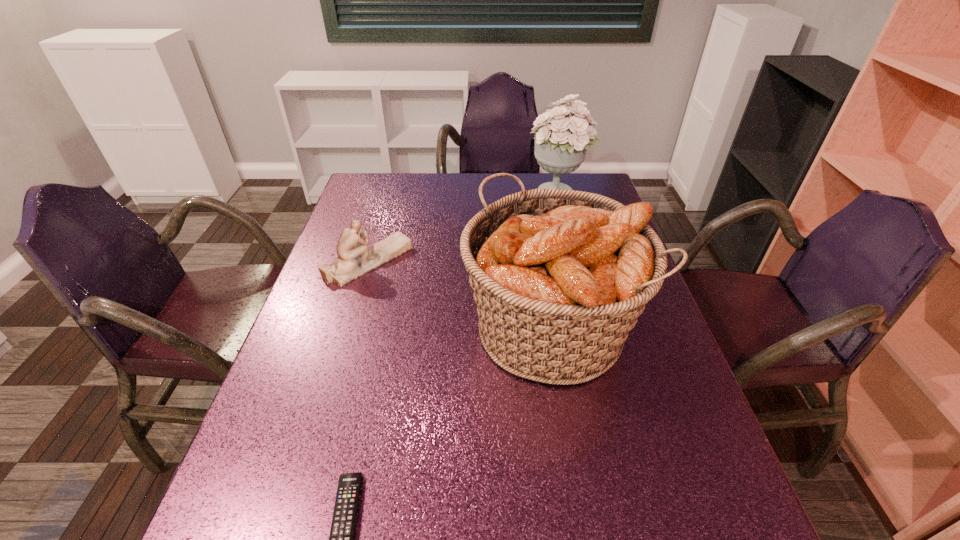
Identify which object is located as the second nearest to the farthest object. Please provide its 2D coordinates. Your answer should be formatted as a tuple, i.e. [(x, y)], where the tuple contains the x and y coordinates of a point satisfying the conditions above.

[(354, 259)]

I want to click on vacant point that satisfies the following two spatial constraints: 1. on the front-facing side of the third tallest object; 2. on the right side of the basket, so click(348, 329).

At what (x,y) coordinates should I click in order to perform the action: click on vacant area that satisfies the following two spatial constraints: 1. on the front-facing side of the third tallest object; 2. on the left side of the basket. Please return your answer as a coordinate pair (x, y). Image resolution: width=960 pixels, height=540 pixels. Looking at the image, I should click on (348, 329).